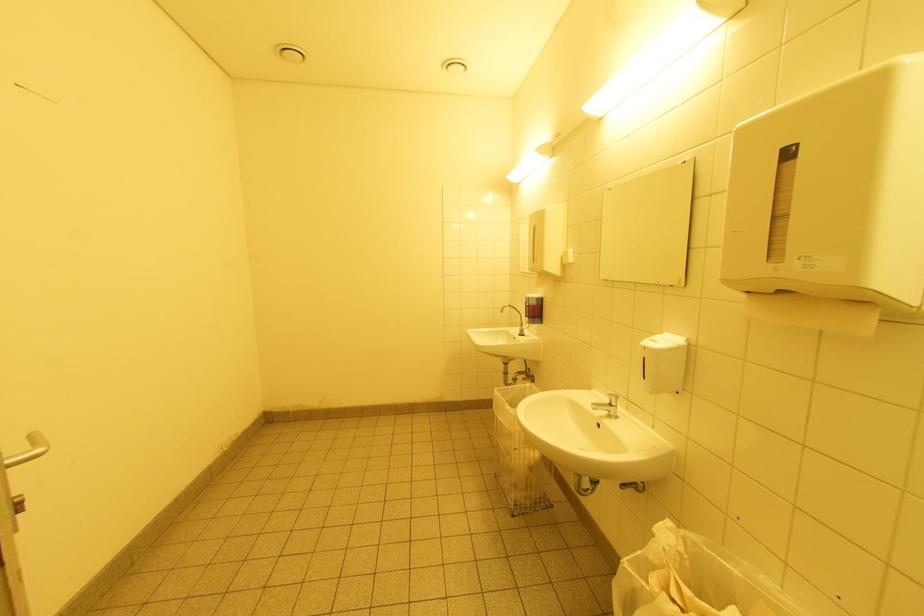
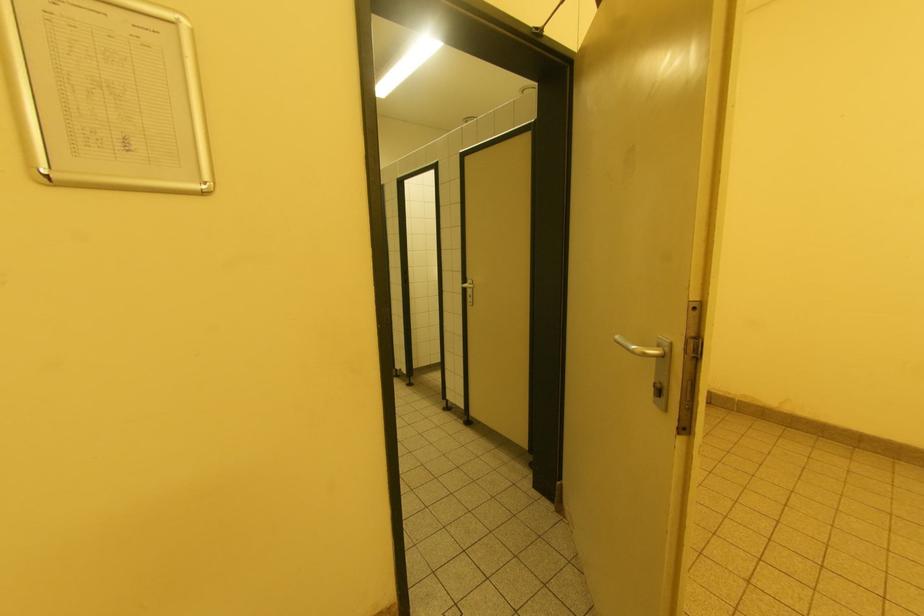
Question: Based on the continuous images, in which direction is the camera rotating? Reply with the corresponding letter.

Choices:
 (A) Left
 (B) Right
 (C) Up
 (D) Down

Answer: (A)